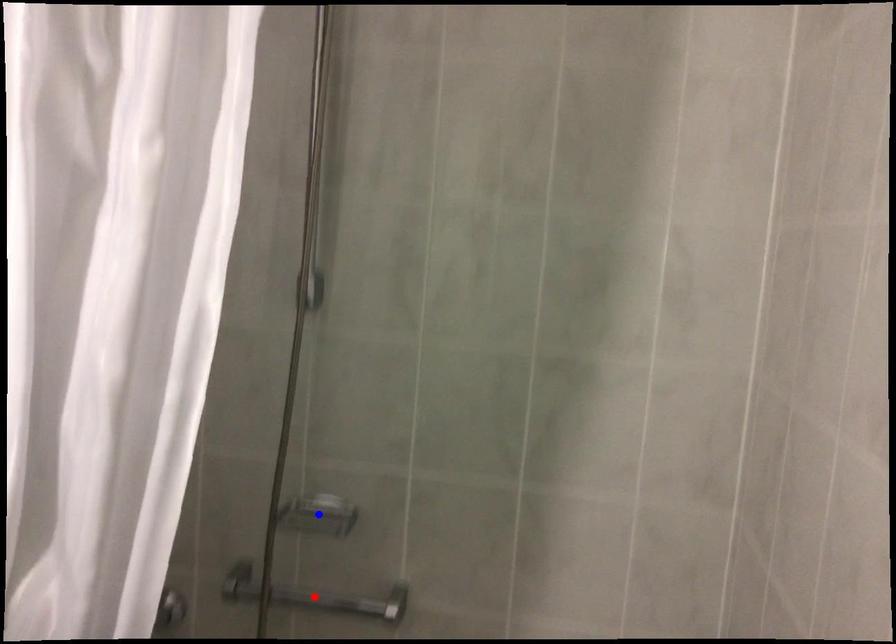
Question: In the image, two points are highlighted. Which point is nearer to the camera? Reply with the corresponding letter.

Choices:
 (A) blue point
 (B) red point

Answer: (A)